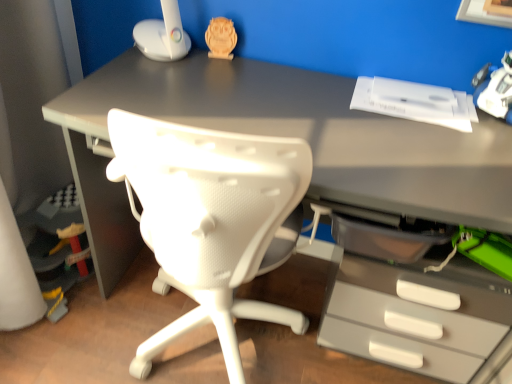
At what (x,y) coordinates should I click in order to perform the action: click on vacant space in front of white plastic toy at upper right, positioned as the 1th toy in bottom-to-top order. Please return your answer as a coordinate pair (x, y). The height and width of the screenshot is (384, 512). Looking at the image, I should click on (485, 144).